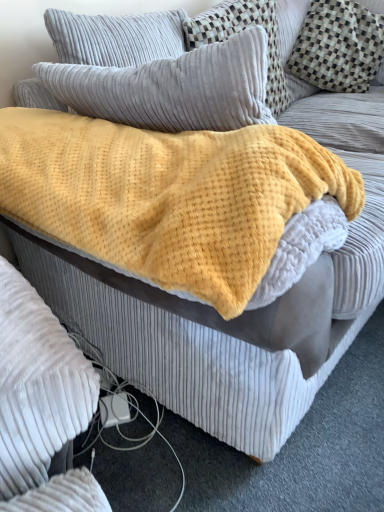
I want to click on yellow fuzzy blanket at center, so click(x=168, y=196).

You are a GUI agent. You are given a task and a screenshot of the screen. Output one action in this format:
    pyautogui.click(x=<x>, y=<y>)
    Task: Click on the checkered fabric pillow at upper right, the 3th pillow in the left-to-right sequence
    The width and height of the screenshot is (384, 512).
    Given the screenshot: What is the action you would take?
    tap(338, 47)

From a real-world perspective, is yellow fuzzy blanket at center over velvety gray pillow at upper left, which appears as the 1th pillow when viewed from the left?

Incorrect, from a real-world perspective, yellow fuzzy blanket at center is lower than velvety gray pillow at upper left, which appears as the 1th pillow when viewed from the left.

How many degrees apart are the facing directions of yellow fuzzy blanket at center and velvety gray pillow at upper left, the 3th pillow viewed from the right?

They differ by 1.81 degrees in their facing directions.

Measure the distance between yellow fuzzy blanket at center and velvety gray pillow at upper left, which appears as the 1th pillow when viewed from the left.

yellow fuzzy blanket at center and velvety gray pillow at upper left, which appears as the 1th pillow when viewed from the left, are 14.95 centimeters apart from each other.

Which is less distant, (175, 282) or (55, 88)?

Point (175, 282)

Looking at their sizes, would you say yellow fuzzy blanket at center is wider or thinner than velvet gray pillow at upper center, the 2th pillow when ordered from left to right?

yellow fuzzy blanket at center is wider than velvet gray pillow at upper center, the 2th pillow when ordered from left to right.

How much distance is there between yellow fuzzy blanket at center and velvet gray pillow at upper center, the 2th pillow when ordered from left to right?

yellow fuzzy blanket at center is 18.87 inches from velvet gray pillow at upper center, the 2th pillow when ordered from left to right.

Between yellow fuzzy blanket at center and velvet gray pillow at upper center, the 2th pillow from the right, which one has smaller size?

Smaller between the two is velvet gray pillow at upper center, the 2th pillow from the right.

From the image's perspective, would you say velvety gray pillow at upper left, the 3th pillow viewed from the right, is shown under velvet gray pillow at upper center, the 2th pillow from the right?

Yes, from the image's perspective, velvety gray pillow at upper left, the 3th pillow viewed from the right, is beneath velvet gray pillow at upper center, the 2th pillow from the right.

Which object is more forward, velvety gray pillow at upper left, which appears as the 1th pillow when viewed from the left, or velvet gray pillow at upper center, the 2th pillow from the right?

Positioned in front is velvety gray pillow at upper left, which appears as the 1th pillow when viewed from the left.

Considering the relative sizes of velvety gray pillow at upper left, the 3th pillow viewed from the right, and velvet gray pillow at upper center, the 2th pillow when ordered from left to right, in the image provided, is velvety gray pillow at upper left, the 3th pillow viewed from the right, taller than velvet gray pillow at upper center, the 2th pillow when ordered from left to right,?

In fact, velvety gray pillow at upper left, the 3th pillow viewed from the right, may be shorter than velvet gray pillow at upper center, the 2th pillow when ordered from left to right.

Is checkered fabric pillow at upper right, the first pillow from the right, located outside velvet gray pillow at upper center, the 2th pillow when ordered from left to right?

Indeed, checkered fabric pillow at upper right, the first pillow from the right, is completely outside velvet gray pillow at upper center, the 2th pillow when ordered from left to right.

Does checkered fabric pillow at upper right, the first pillow from the right, appear on the left side of velvet gray pillow at upper center, the 2th pillow when ordered from left to right?

No.

Considering the positions of points (328, 64) and (267, 51), is point (328, 64) closer to camera compared to point (267, 51)?

No, (328, 64) is behind (267, 51).

From a real-world perspective, is checkered fabric pillow at upper right, the first pillow from the right, positioned over yellow fuzzy blanket at center based on gravity?

Actually, checkered fabric pillow at upper right, the first pillow from the right, is physically below yellow fuzzy blanket at center in the real world.

Is point (362, 51) positioned after point (234, 258)?

Yes, point (362, 51) is behind point (234, 258).

From the image's perspective, is checkered fabric pillow at upper right, the 3th pillow in the left-to-right sequence, positioned above or below yellow fuzzy blanket at center?

Based on their image positions, checkered fabric pillow at upper right, the 3th pillow in the left-to-right sequence, is located above yellow fuzzy blanket at center.

Looking at this image, does checkered fabric pillow at upper right, the 3th pillow in the left-to-right sequence, have a greater height compared to yellow fuzzy blanket at center?

Yes, checkered fabric pillow at upper right, the 3th pillow in the left-to-right sequence, is taller than yellow fuzzy blanket at center.

Which object is thinner, velvety gray pillow at upper left, the 3th pillow viewed from the right, or yellow fuzzy blanket at center?

Thinner between the two is velvety gray pillow at upper left, the 3th pillow viewed from the right.

How many degrees apart are the facing directions of velvety gray pillow at upper left, which appears as the 1th pillow when viewed from the left, and yellow fuzzy blanket at center?

They differ by 1.81 degrees in their facing directions.

Looking at this image, is velvety gray pillow at upper left, which appears as the 1th pillow when viewed from the left, further to the viewer compared to yellow fuzzy blanket at center?

Yes, velvety gray pillow at upper left, which appears as the 1th pillow when viewed from the left, is behind yellow fuzzy blanket at center.

Is velvety gray pillow at upper left, which appears as the 1th pillow when viewed from the left, placed right next to yellow fuzzy blanket at center?

No, velvety gray pillow at upper left, which appears as the 1th pillow when viewed from the left, is not touching yellow fuzzy blanket at center.

Measure the distance from velvet gray pillow at upper center, the 2th pillow when ordered from left to right, to velvety gray pillow at upper left, the 3th pillow viewed from the right.

The distance of velvet gray pillow at upper center, the 2th pillow when ordered from left to right, from velvety gray pillow at upper left, the 3th pillow viewed from the right, is 14.95 inches.

Does point (279, 103) lie behind point (245, 90)?

Yes, point (279, 103) is farther from viewer.

From the picture: Could you tell me if velvet gray pillow at upper center, the 2th pillow from the right, is facing velvety gray pillow at upper left, which appears as the 1th pillow when viewed from the left?

No, velvet gray pillow at upper center, the 2th pillow from the right, is not oriented towards velvety gray pillow at upper left, which appears as the 1th pillow when viewed from the left.

Who is shorter, velvet gray pillow at upper center, the 2th pillow from the right, or velvety gray pillow at upper left, the 3th pillow viewed from the right?

Standing shorter between the two is velvety gray pillow at upper left, the 3th pillow viewed from the right.

Find the location of a particular element. The height and width of the screenshot is (512, 384). blanket that appears on the left of velvety gray pillow at upper left, the 3th pillow viewed from the right is located at coordinates (168, 196).

The height and width of the screenshot is (512, 384). I want to click on pillow that is the 2nd object located behind the yellow fuzzy blanket at center, so click(x=238, y=32).

Considering their positions, is checkered fabric pillow at upper right, the 3th pillow in the left-to-right sequence, positioned closer to velvety gray pillow at upper left, the 3th pillow viewed from the right, than velvet gray pillow at upper center, the 2th pillow from the right?

velvet gray pillow at upper center, the 2th pillow from the right, is closer to velvety gray pillow at upper left, the 3th pillow viewed from the right.

Considering their positions, is checkered fabric pillow at upper right, the 3th pillow in the left-to-right sequence, positioned closer to yellow fuzzy blanket at center than velvet gray pillow at upper center, the 2th pillow when ordered from left to right?

Based on the image, velvet gray pillow at upper center, the 2th pillow when ordered from left to right, appears to be nearer to yellow fuzzy blanket at center.

From the image, which object appears to be farther from velvety gray pillow at upper left, which appears as the 1th pillow when viewed from the left, yellow fuzzy blanket at center or velvet gray pillow at upper center, the 2th pillow when ordered from left to right?

The object further to velvety gray pillow at upper left, which appears as the 1th pillow when viewed from the left, is velvet gray pillow at upper center, the 2th pillow when ordered from left to right.

When comparing their distances from velvet gray pillow at upper center, the 2th pillow when ordered from left to right, does checkered fabric pillow at upper right, the 3th pillow in the left-to-right sequence, or yellow fuzzy blanket at center seem closer?

Among the two, checkered fabric pillow at upper right, the 3th pillow in the left-to-right sequence, is located nearer to velvet gray pillow at upper center, the 2th pillow when ordered from left to right.

Looking at the image, which one is located further to checkered fabric pillow at upper right, the first pillow from the right, velvety gray pillow at upper left, the 3th pillow viewed from the right, or yellow fuzzy blanket at center?

Based on the image, yellow fuzzy blanket at center appears to be further to checkered fabric pillow at upper right, the first pillow from the right.

When comparing their distances from velvety gray pillow at upper left, which appears as the 1th pillow when viewed from the left, does yellow fuzzy blanket at center or checkered fabric pillow at upper right, the 3th pillow in the left-to-right sequence, seem further?

The object further to velvety gray pillow at upper left, which appears as the 1th pillow when viewed from the left, is checkered fabric pillow at upper right, the 3th pillow in the left-to-right sequence.

When comparing their distances from checkered fabric pillow at upper right, the 3th pillow in the left-to-right sequence, does velvet gray pillow at upper center, the 2th pillow when ordered from left to right, or velvety gray pillow at upper left, which appears as the 1th pillow when viewed from the left, seem closer?

velvet gray pillow at upper center, the 2th pillow when ordered from left to right, is positioned closer to the anchor checkered fabric pillow at upper right, the 3th pillow in the left-to-right sequence.

When comparing their distances from velvet gray pillow at upper center, the 2th pillow when ordered from left to right, does velvety gray pillow at upper left, which appears as the 1th pillow when viewed from the left, or checkered fabric pillow at upper right, the first pillow from the right, seem closer?

The object closer to velvet gray pillow at upper center, the 2th pillow when ordered from left to right, is checkered fabric pillow at upper right, the first pillow from the right.

This screenshot has height=512, width=384. I want to click on pillow situated between velvety gray pillow at upper left, which appears as the 1th pillow when viewed from the left, and checkered fabric pillow at upper right, the first pillow from the right, from left to right, so (238, 32).

Find the location of a particular element. Image resolution: width=384 pixels, height=512 pixels. pillow between yellow fuzzy blanket at center and velvet gray pillow at upper center, the 2th pillow when ordered from left to right, along the z-axis is located at coordinates (173, 88).